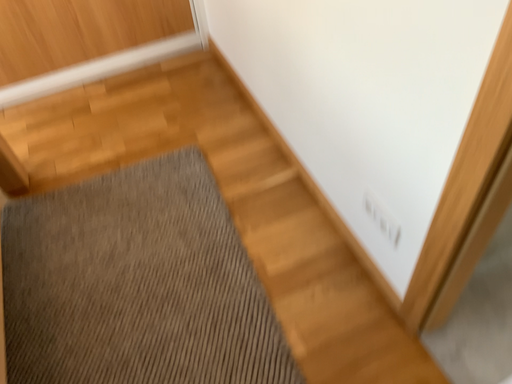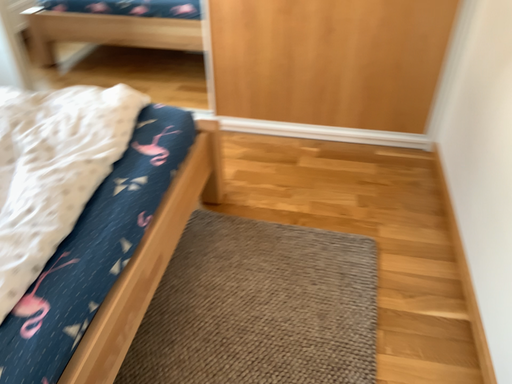
Question: How did the camera likely rotate when shooting the video?

Choices:
 (A) rotated downward
 (B) rotated upward

Answer: (B)